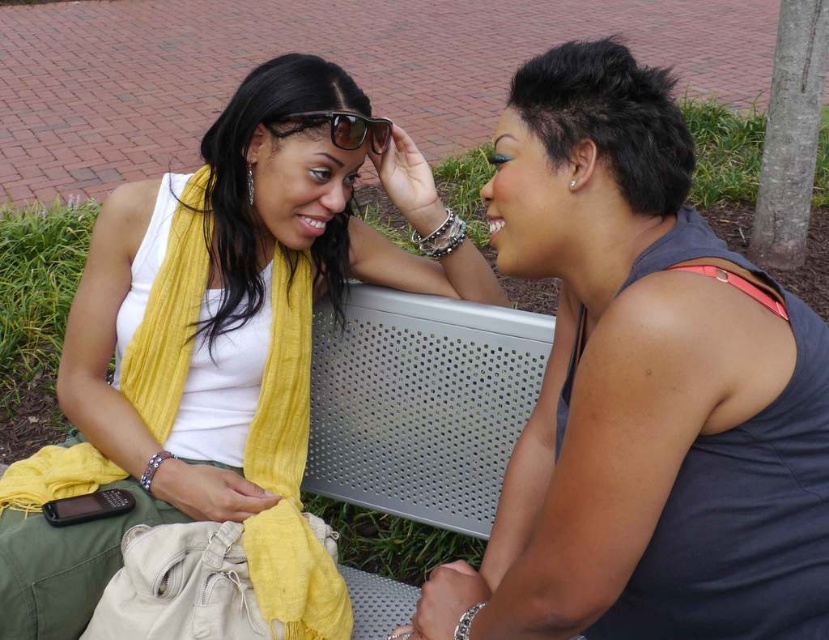
Question: Which of these objects is positioned closest to the sunglasses at center?

Choices:
 (A) dark blue tank top at center
 (B) white matte tank top at upper left

Answer: (B)

Question: Which of the following is the closest to the observer?

Choices:
 (A) dark blue tank top at center
 (B) sunglasses at center

Answer: (A)

Question: Can you confirm if dark blue tank top at center is positioned to the left of sunglasses at center?

Choices:
 (A) yes
 (B) no

Answer: (B)

Question: Considering the relative positions of white matte tank top at upper left and sunglasses at center in the image provided, where is white matte tank top at upper left located with respect to sunglasses at center?

Choices:
 (A) right
 (B) left

Answer: (B)

Question: Which of the following is the farthest from the observer?

Choices:
 (A) sunglasses at center
 (B) dark blue tank top at center
 (C) white matte tank top at upper left

Answer: (A)

Question: Does dark blue tank top at center come in front of white matte tank top at upper left?

Choices:
 (A) yes
 (B) no

Answer: (A)